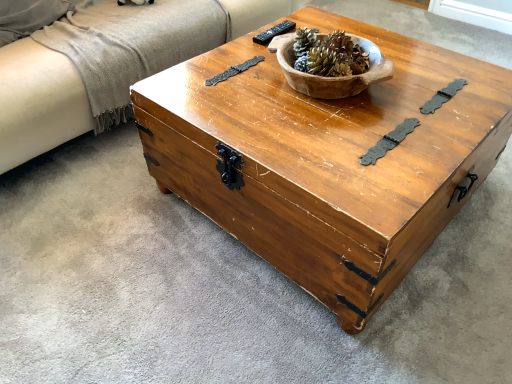
Question: Is wooden chest at center located outside black plastic remote at upper center?

Choices:
 (A) no
 (B) yes

Answer: (B)

Question: Is wooden chest at center positioned with its back to black plastic remote at upper center?

Choices:
 (A) yes
 (B) no

Answer: (B)

Question: Does wooden chest at center have a greater width compared to black plastic remote at upper center?

Choices:
 (A) no
 (B) yes

Answer: (B)

Question: From a real-world perspective, is wooden chest at center under black plastic remote at upper center?

Choices:
 (A) no
 (B) yes

Answer: (B)

Question: Is wooden chest at center not near black plastic remote at upper center?

Choices:
 (A) yes
 (B) no

Answer: (B)

Question: Is wooden chest at center at the right side of black plastic remote at upper center?

Choices:
 (A) yes
 (B) no

Answer: (A)

Question: From a real-world perspective, is wooden bowl at center on beige fabric couch at left?

Choices:
 (A) no
 (B) yes

Answer: (B)

Question: Considering the relative sizes of wooden bowl at center and beige fabric couch at left in the image provided, is wooden bowl at center wider than beige fabric couch at left?

Choices:
 (A) no
 (B) yes

Answer: (A)

Question: Considering the relative sizes of wooden bowl at center and beige fabric couch at left in the image provided, is wooden bowl at center taller than beige fabric couch at left?

Choices:
 (A) yes
 (B) no

Answer: (B)

Question: Is wooden bowl at center further to the viewer compared to beige fabric couch at left?

Choices:
 (A) no
 (B) yes

Answer: (A)

Question: Considering the relative sizes of wooden bowl at center and beige fabric couch at left in the image provided, is wooden bowl at center shorter than beige fabric couch at left?

Choices:
 (A) no
 (B) yes

Answer: (B)

Question: Is wooden bowl at center with beige fabric couch at left?

Choices:
 (A) no
 (B) yes

Answer: (A)

Question: Does wooden bowl at center have a larger size compared to black plastic remote at upper center?

Choices:
 (A) no
 (B) yes

Answer: (B)